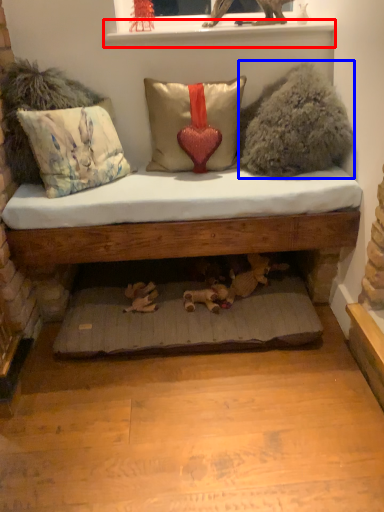
Question: Which object is closer to the camera taking this photo, window sill (highlighted by a red box) or animal (highlighted by a blue box)?

Choices:
 (A) window sill
 (B) animal

Answer: (B)